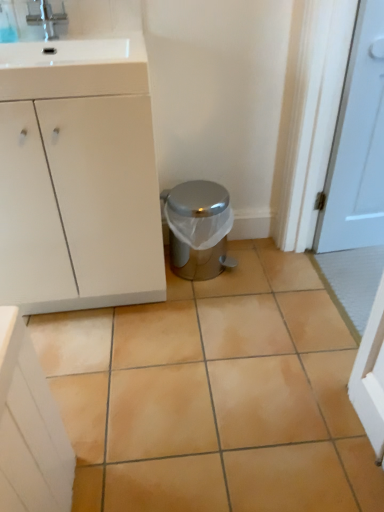
Question: Considering the relative sizes of white matte cabinet at left and beige ceramic tile at center in the image provided, is white matte cabinet at left taller than beige ceramic tile at center?

Choices:
 (A) no
 (B) yes

Answer: (B)

Question: Can you see white matte cabinet at left touching beige ceramic tile at center?

Choices:
 (A) no
 (B) yes

Answer: (A)

Question: Does white matte cabinet at left have a larger size compared to beige ceramic tile at center?

Choices:
 (A) no
 (B) yes

Answer: (B)

Question: Is white matte cabinet at left to the left of beige ceramic tile at center from the viewer's perspective?

Choices:
 (A) no
 (B) yes

Answer: (B)

Question: From the image's perspective, is white matte cabinet at left on top of beige ceramic tile at center?

Choices:
 (A) yes
 (B) no

Answer: (A)

Question: Is point (145, 77) positioned closer to the camera than point (307, 325)?

Choices:
 (A) closer
 (B) farther

Answer: (A)

Question: Is white glossy sink at upper left in front of or behind beige ceramic tile at center in the image?

Choices:
 (A) behind
 (B) front

Answer: (A)

Question: Is white glossy sink at upper left wider or thinner than beige ceramic tile at center?

Choices:
 (A) thin
 (B) wide

Answer: (A)

Question: From the image's perspective, is white glossy sink at upper left located above or below beige ceramic tile at center?

Choices:
 (A) below
 (B) above

Answer: (B)

Question: Visually, is white matte cabinet at left positioned to the left or to the right of satin silver trash can at center?

Choices:
 (A) left
 (B) right

Answer: (A)

Question: Considering the positions of white matte cabinet at left and satin silver trash can at center in the image, is white matte cabinet at left wider or thinner than satin silver trash can at center?

Choices:
 (A) thin
 (B) wide

Answer: (B)

Question: From the image's perspective, is white matte cabinet at left above or below satin silver trash can at center?

Choices:
 (A) above
 (B) below

Answer: (A)

Question: In the image, is white matte cabinet at left positioned in front of or behind satin silver trash can at center?

Choices:
 (A) front
 (B) behind

Answer: (A)

Question: Considering the positions of satin silver trash can at center and brushed metal faucet at upper left in the image, is satin silver trash can at center wider or thinner than brushed metal faucet at upper left?

Choices:
 (A) thin
 (B) wide

Answer: (B)

Question: Considering the positions of satin silver trash can at center and brushed metal faucet at upper left in the image, is satin silver trash can at center bigger or smaller than brushed metal faucet at upper left?

Choices:
 (A) big
 (B) small

Answer: (A)